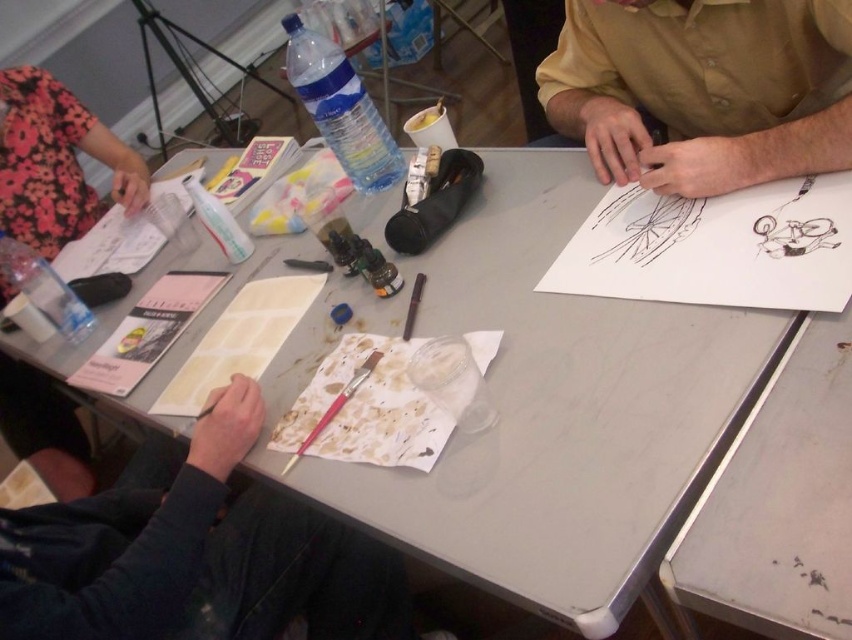
You are an artist trying to set up your camera to take a photo of the smooth black paper at lower left. The camera requires at least 24 inches of space between the subject and the camera to focus properly. Is the current distance sufficient?

The smooth black paper at lower left and camera are 24.81 inches apart from each other, which is more than the required 24 inches, so the distance is sufficient for the camera to focus properly.

You are an artist who wants to place a new sketchbook on the table. The sketchbook is taller than the matte yellow shirt at upper right. Can you fit it on the table where the smooth black paper at lower left is located?

The smooth black paper at lower left has a greater height compared to matte yellow shirt at upper right. Since the sketchbook is taller than the matte yellow shirt at upper right, it can fit on the table where the smooth black paper at lower left is located because the smooth black paper at lower left has sufficient height to accommodate it.

You are an artist who just entered the art workshop and needs to find the smooth black paper at lower left. Based on the coordinates provided, where should you look on the table?

The smooth black paper at lower left is located at the coordinates point (194,552) on the table.